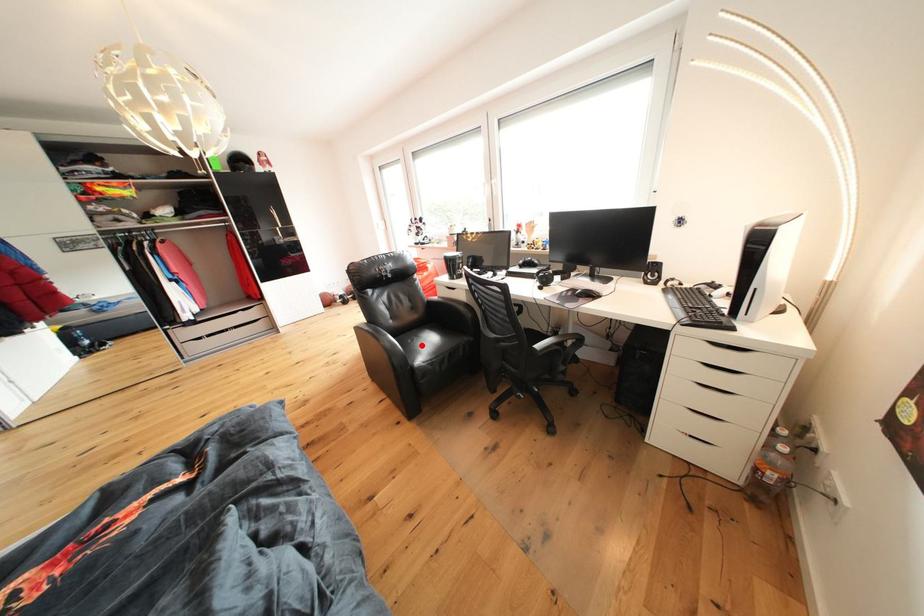
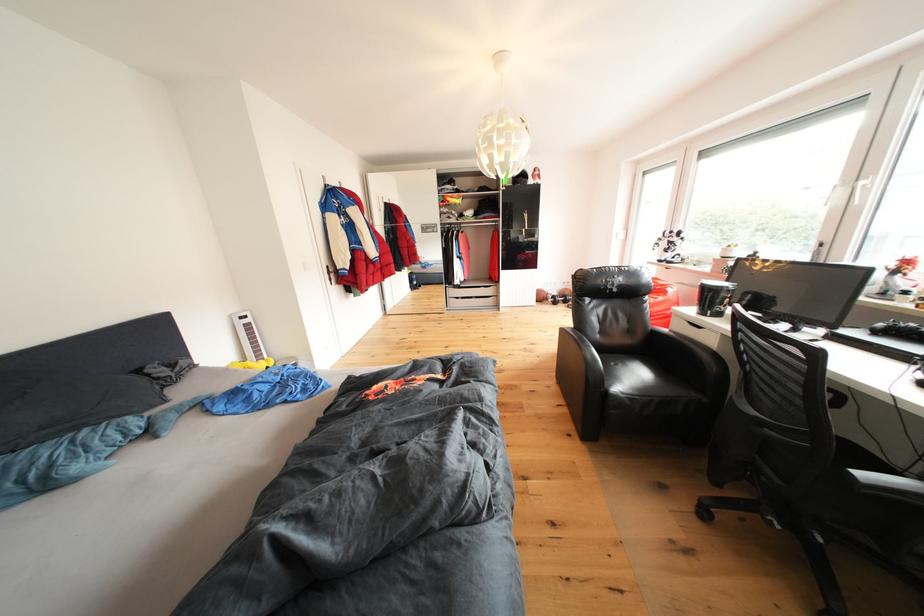
Question: I am providing you with two images of the same scene from different viewpoints. A red point is shown in image1. For the corresponding object point in image2, is it positioned nearer or farther from the camera?

Choices:
 (A) Nearer
 (B) Farther

Answer: (B)